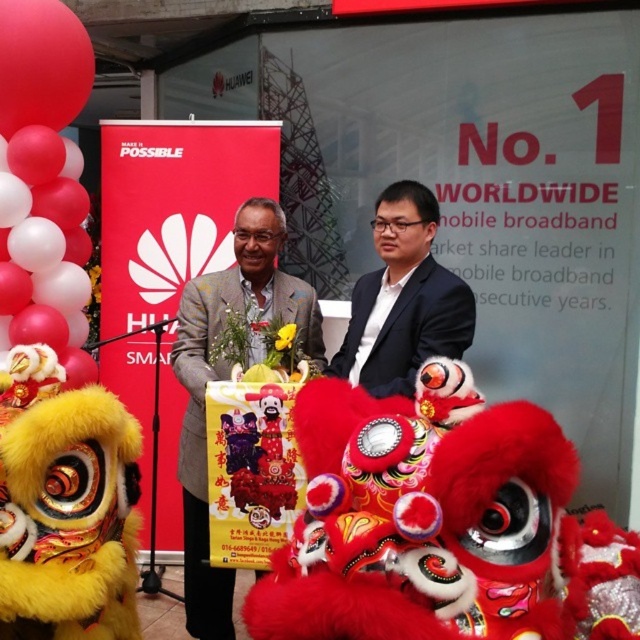
Question: Is gray textured suit at center to the left of black glossy suit at center from the viewer's perspective?

Choices:
 (A) yes
 (B) no

Answer: (A)

Question: Does red matte balloons at upper left have a lesser width compared to black glossy suit at center?

Choices:
 (A) yes
 (B) no

Answer: (A)

Question: Among these points, which one is farthest from the camera?

Choices:
 (A) (68, 202)
 (B) (202, 573)

Answer: (A)

Question: Which point is closer to the camera?

Choices:
 (A) black glossy suit at center
 (B) gray textured suit at center

Answer: (A)

Question: Which object is closer to the camera taking this photo?

Choices:
 (A) black glossy suit at center
 (B) red matte balloons at upper left
 (C) gray textured suit at center

Answer: (A)

Question: Is gray textured suit at center to the left of black glossy suit at center from the viewer's perspective?

Choices:
 (A) no
 (B) yes

Answer: (B)